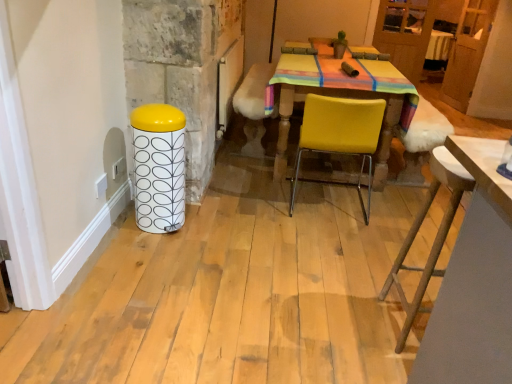
This screenshot has height=384, width=512. What are the coordinates of `empty space that is to the right of yellow matte chair at center` in the screenshot? It's located at (388, 209).